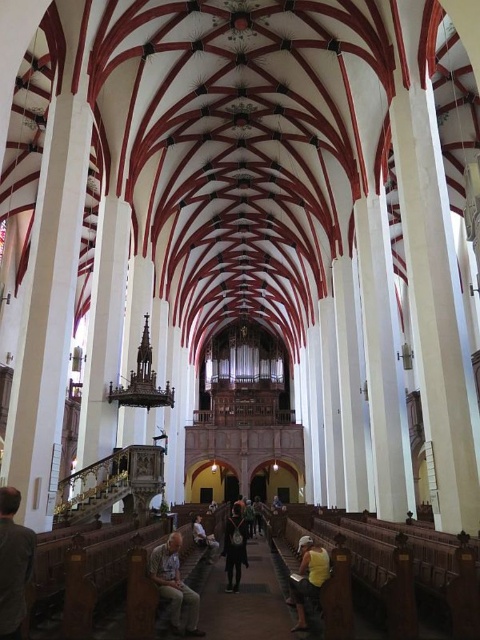
You are standing in the Gothic church and notice two people wearing a gray fabric jacket at lower left and a yellow matte shirt at center. Which person is closer to you?

The gray fabric jacket at lower left is closer to you because it is positioned in front of the yellow matte shirt at center.

You are standing in the grand Gothic church and notice two jackets near the entrance. The gray fabric jacket at lower left and the light brown leather jacket at lower center. Which jacket is positioned higher relative to the other?

The gray fabric jacket at lower left is positioned higher than the light brown leather jacket at lower center as it is placed above it.